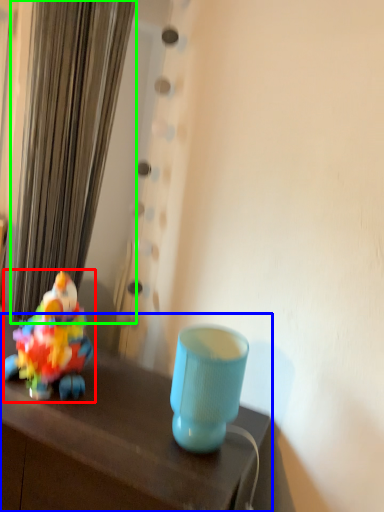
Question: Which object is the farthest from toy (highlighted by a red box)? Choose among these: table (highlighted by a blue box) or curtain (highlighted by a green box).

Choices:
 (A) table
 (B) curtain

Answer: (B)